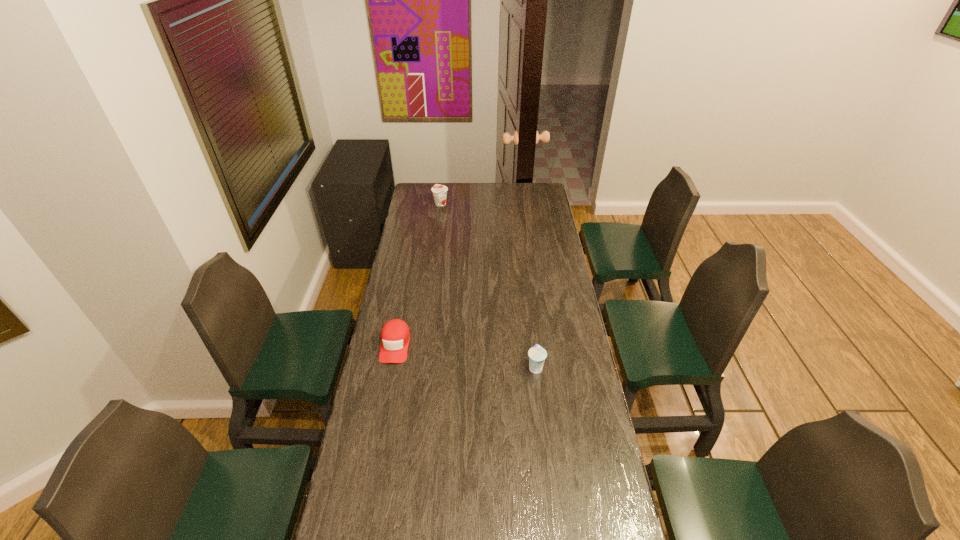
In order to click on the left yogurt in this screenshot , I will do `click(439, 191)`.

This screenshot has height=540, width=960. I want to click on the farther yogurt, so click(439, 191).

Where is `the rightmost object`? The width and height of the screenshot is (960, 540). the rightmost object is located at coordinates (x=537, y=355).

This screenshot has height=540, width=960. I want to click on the nearer yogurt, so click(x=537, y=355).

Find the location of `the leftmost object`. the leftmost object is located at coordinates tap(395, 335).

Locate an element on the screen. This screenshot has width=960, height=540. vacant space located 0.400m on the right of the left yogurt is located at coordinates (517, 204).

What are the coordinates of `vacant region located 0.060m on the front of the nearer yogurt` in the screenshot? It's located at (539, 390).

You are a GUI agent. You are given a task and a screenshot of the screen. Output one action in this format:
    pyautogui.click(x=<x>, y=<y>)
    Task: Click on the vacant space located 0.200m on the front-facing side of the baseball cap
    Image resolution: width=960 pixels, height=540 pixels.
    Given the screenshot: What is the action you would take?
    pyautogui.click(x=383, y=410)

This screenshot has height=540, width=960. Find the location of `object that is positioned at the far edge`. object that is positioned at the far edge is located at coordinates (439, 191).

At what (x,y) coordinates should I click in order to perform the action: click on yogurt located at the left edge. Please return your answer as a coordinate pair (x, y). Looking at the image, I should click on (439, 191).